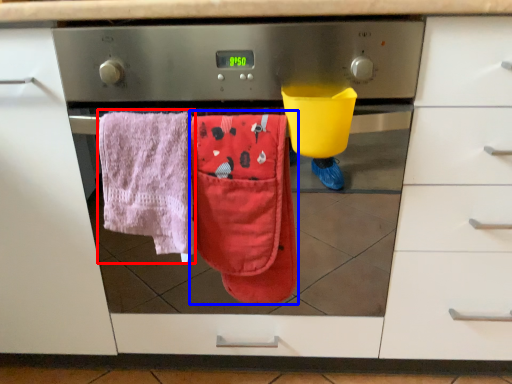
Question: Among these objects, which one is nearest to the camera, beach towel (highlighted by a red box) or beach towel (highlighted by a blue box)?

Choices:
 (A) beach towel
 (B) beach towel

Answer: (A)